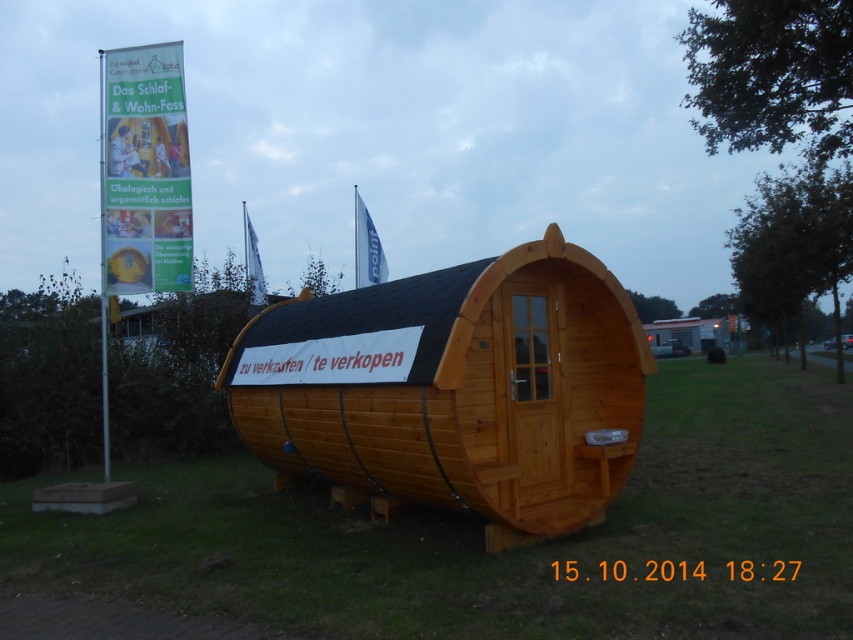
You are standing at the entrance of the wooden structure and want to place a decorative rock exactly at the center of the green grass at center. According to the image, what are the coordinates where you should place the rock?

The coordinates for the green grass at center are at point (508, 552), so you should place the decorative rock there.

You are standing in front of the wooden structure with the white banner. There are two points marked on the structure. Which point is closer to you, point at coordinates (509,339) or point at coordinates (117,61)?

Point at coordinates (509,339) is in front of point at coordinates (117,61), so it is closer to you.